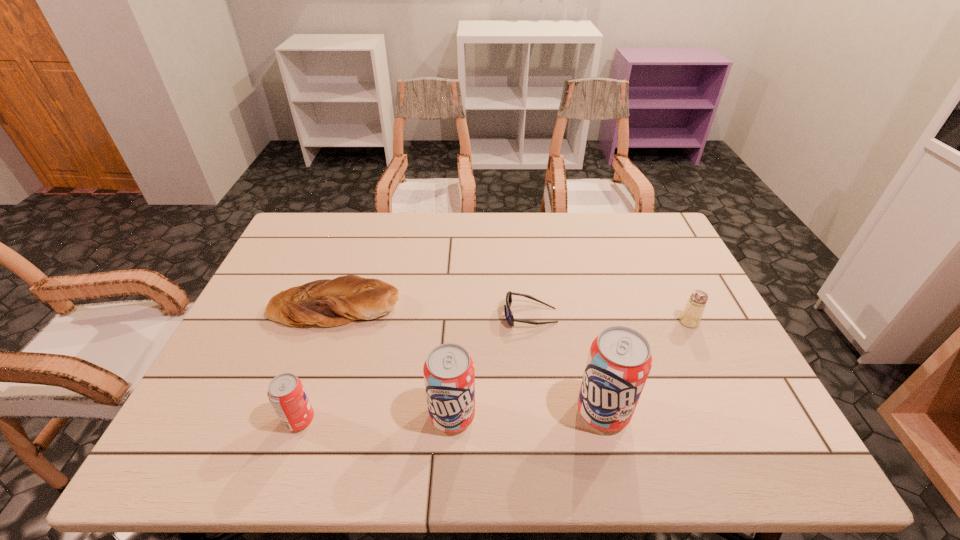
Locate an element on the screen. free space located 0.180m on the back of the shortest soda can is located at coordinates (325, 345).

At what (x,y) coordinates should I click in order to perform the action: click on vacant space located on the back of the fifth shortest object. Please return your answer as a coordinate pair (x, y). This screenshot has height=540, width=960. Looking at the image, I should click on (458, 302).

The width and height of the screenshot is (960, 540). What are the coordinates of `vacant space located 0.110m on the left of the rightmost soda can` in the screenshot? It's located at (527, 412).

Identify the location of vacant area located on the front-facing side of the sunglasses. (474, 315).

You are a GUI agent. You are given a task and a screenshot of the screen. Output one action in this format:
    pyautogui.click(x=<x>, y=<y>)
    Task: Click on the free space located on the front-facing side of the sunglasses
    
    Given the screenshot: What is the action you would take?
    pyautogui.click(x=420, y=315)

Image resolution: width=960 pixels, height=540 pixels. In order to click on vacant region located 0.260m on the front-facing side of the sunglasses in this screenshot , I will do `click(409, 315)`.

Locate an element on the screen. free space located on the front of the bread is located at coordinates (309, 381).

Locate an element on the screen. vacant region located on the front of the saltshaker is located at coordinates (699, 343).

This screenshot has width=960, height=540. I want to click on object present at the left edge, so click(325, 302).

This screenshot has width=960, height=540. Identify the location of object at the right edge. pos(691,315).